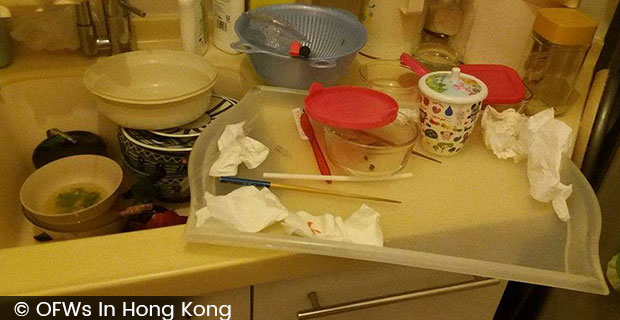
Locate an element on the screen. faucet is located at coordinates (90, 21).